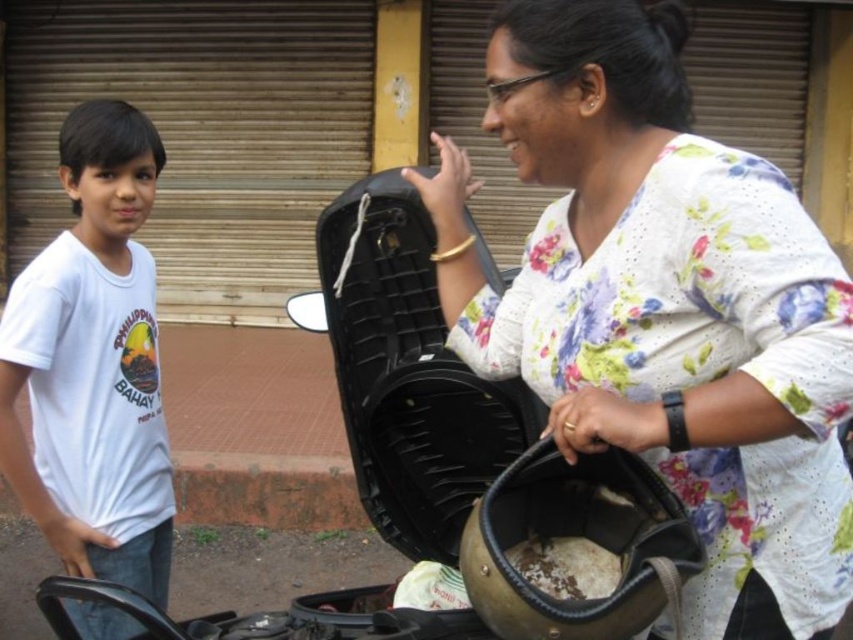
You are a photographer standing 4 feet away from the floral cotton shirt at center. Can you take a clear photo of it without moving closer?

The floral cotton shirt at center and viewer are 3.57 feet apart, so yes, you can take a clear photo of it without moving closer since you are already within the 4 feet distance.